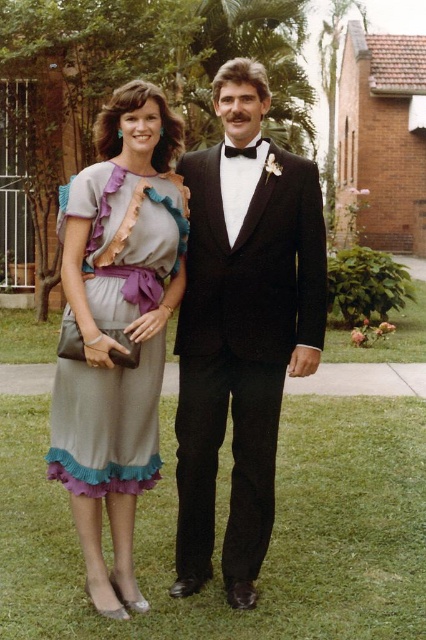
You are a photographer setting up for a formal event. You need to ensure that both the matte gray dress with ruffled trim at center and the black satin bow tie at center are visible in the photo. Based on their positions, which one is closer to the camera?

The matte gray dress with ruffled trim at center is closer to the camera because it is positioned in front of the black satin bow tie at center.

You are taking a photo of the scene and want to focus on both the point at point (x=316, y=221) and the point at point (x=138, y=406). Which point should you focus on first to ensure both are in focus?

You should focus on point (x=316, y=221) first because it is closer to the camera than point (x=138, y=406). This way, adjusting focus from closer to farther will help both points be in focus.